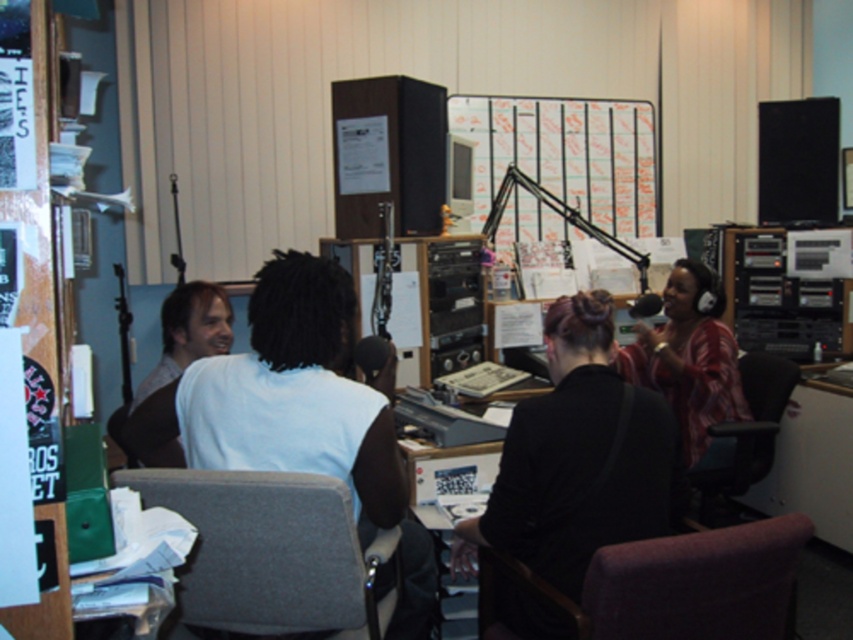
Is purple fabric swivel chair at lower right in front of black leather chair at lower right?

Yes, it is in front of black leather chair at lower right.

Between point (730, 598) and point (688, 472), which one is positioned in front?

Point (730, 598)

This screenshot has height=640, width=853. In order to click on purple fabric swivel chair at lower right in this screenshot , I will do `click(672, 586)`.

Does black matte shirt at center lie behind black leather chair at lower right?

That is False.

Is black matte shirt at center thinner than black leather chair at lower right?

No.

This screenshot has height=640, width=853. Describe the element at coordinates (576, 458) in the screenshot. I see `black matte shirt at center` at that location.

Image resolution: width=853 pixels, height=640 pixels. In order to click on black matte shirt at center in this screenshot , I will do [576, 458].

Looking at this image, who is positioned more to the right, purple fabric swivel chair at lower right or plaid fabric shirt at right?

plaid fabric shirt at right is more to the right.

Between point (715, 582) and point (717, 336), which one is positioned in front?

Point (715, 582) is more forward.

I want to click on purple fabric swivel chair at lower right, so click(672, 586).